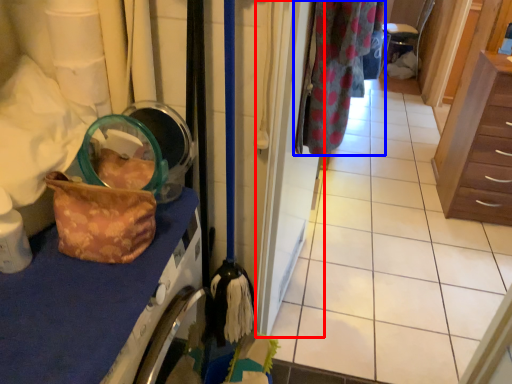
Question: Which object appears closest to the camera in this image, door (highlighted by a red box) or clothing (highlighted by a blue box)?

Choices:
 (A) door
 (B) clothing

Answer: (A)